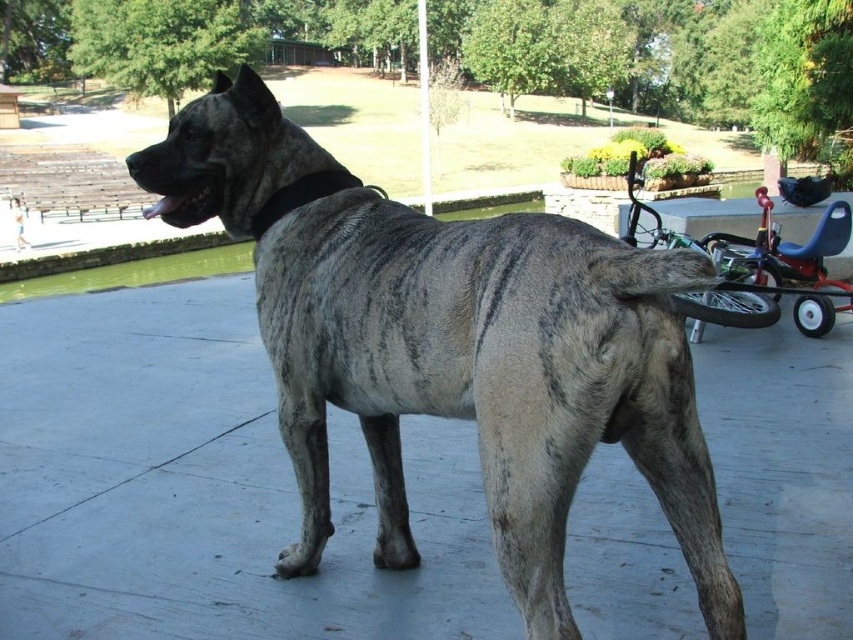
Question: Does brindle fur dog at center appear on the left side of metallic blue baby carriage at right?

Choices:
 (A) yes
 (B) no

Answer: (A)

Question: Is brindle fur dog at center wider than metallic blue baby carriage at right?

Choices:
 (A) no
 (B) yes

Answer: (B)

Question: Which object is farther from the camera taking this photo?

Choices:
 (A) metallic blue baby carriage at right
 (B) brindle fur dog at center

Answer: (A)

Question: Is brindle fur dog at center below metallic blue baby carriage at right?

Choices:
 (A) yes
 (B) no

Answer: (A)

Question: Among these points, which one is nearest to the camera?

Choices:
 (A) (788, 244)
 (B) (473, 294)

Answer: (B)